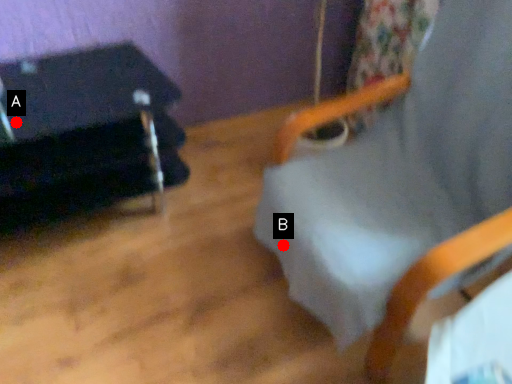
Question: Two points are circled on the image, labeled by A and B beside each circle. Which of the following is the closest to the observer?

Choices:
 (A) A is closer
 (B) B is closer

Answer: (B)